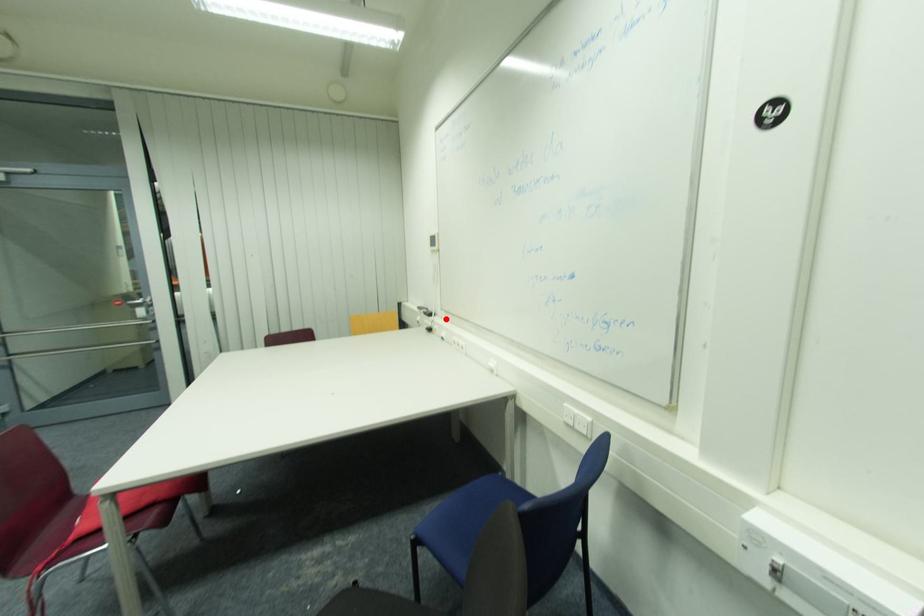
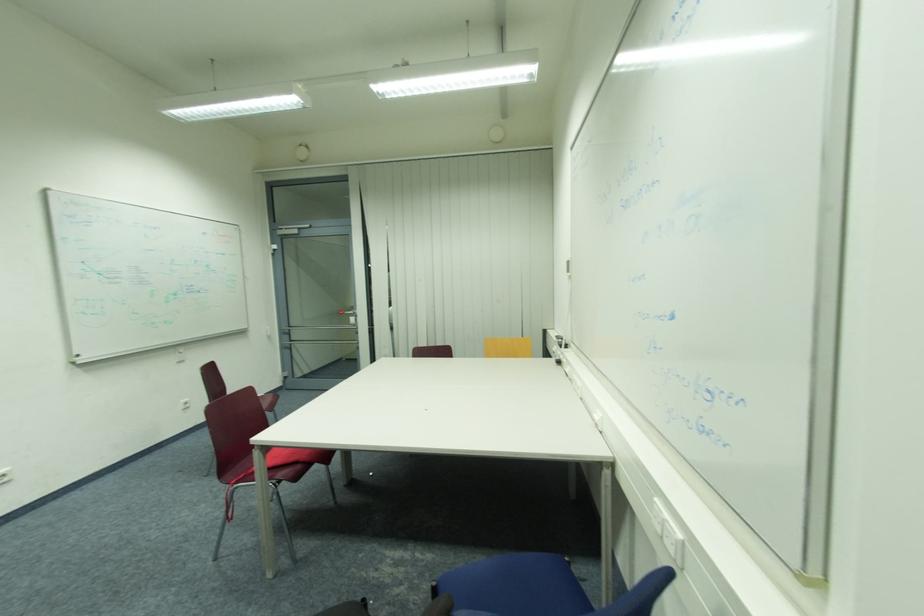
The point at the highlighted location is marked in the first image. Where is the corresponding point in the second image?

(578, 352)